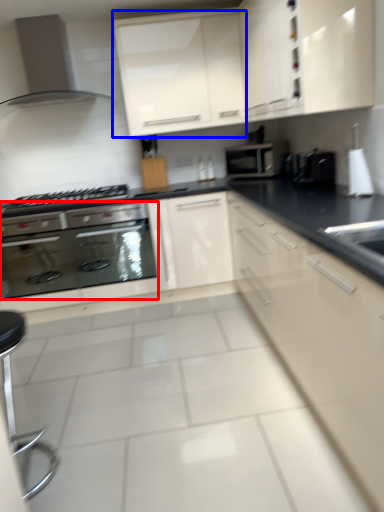
Question: Which point is further to the camera, oven (highlighted by a red box) or cabinetry (highlighted by a blue box)?

Choices:
 (A) oven
 (B) cabinetry

Answer: (A)